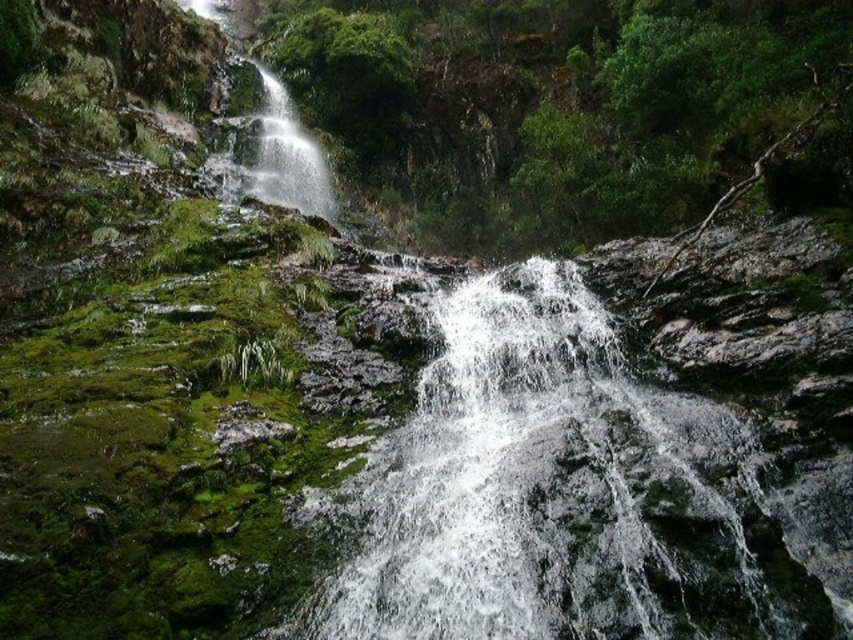
Question: Is green mossy rock at upper center wider than clear water at center?

Choices:
 (A) yes
 (B) no

Answer: (A)

Question: Does green mossy rock at upper center have a greater width compared to clear water at center?

Choices:
 (A) no
 (B) yes

Answer: (B)

Question: Which point is farther to the camera?

Choices:
 (A) (440, 435)
 (B) (555, 129)

Answer: (B)

Question: Does green mossy rock at upper center appear on the right side of clear water at center?

Choices:
 (A) no
 (B) yes

Answer: (A)

Question: Among these objects, which one is nearest to the camera?

Choices:
 (A) clear water at center
 (B) green mossy rock at upper center

Answer: (A)